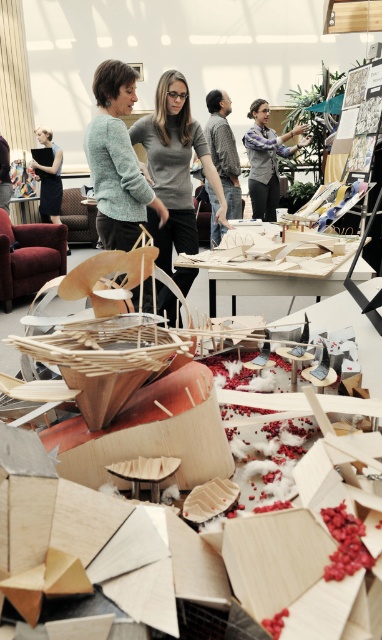
Does matte gray sweater at center come behind plaid shirt at upper center?

That is False.

Does point (135, 136) come farther from viewer compared to point (271, 138)?

No.

Where is `matte gray sweater at center`? This screenshot has width=382, height=640. matte gray sweater at center is located at coordinates pyautogui.click(x=174, y=172).

Is knitted teal sweater at center positioned in front of matte black dress at left?

Yes, it is in front of matte black dress at left.

In the scene shown: How much distance is there between knitted teal sweater at center and matte black dress at left?

knitted teal sweater at center and matte black dress at left are 5.10 meters apart from each other.

Locate an element on the screen. This screenshot has width=382, height=640. knitted teal sweater at center is located at coordinates (116, 161).

You are a GUI agent. You are given a task and a screenshot of the screen. Output one action in this format:
    pyautogui.click(x=<x>, y=<y>)
    Task: Click on the knitted teal sweater at center
    The height and width of the screenshot is (640, 382).
    Given the screenshot: What is the action you would take?
    pyautogui.click(x=116, y=161)

The height and width of the screenshot is (640, 382). What do you see at coordinates (267, 160) in the screenshot? I see `plaid shirt at upper center` at bounding box center [267, 160].

Locate an element on the screen. The image size is (382, 640). plaid shirt at upper center is located at coordinates (267, 160).